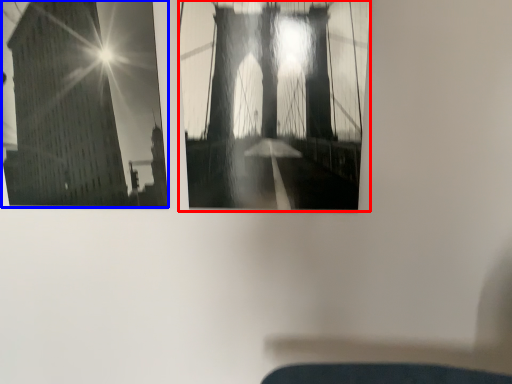
Question: Which point is further to the camera, window (highlighted by a red box) or window (highlighted by a blue box)?

Choices:
 (A) window
 (B) window

Answer: (B)